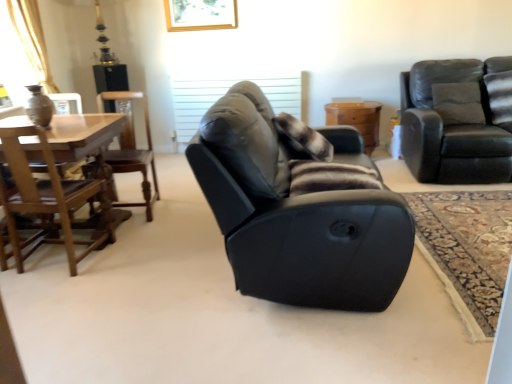
Question: Is velvet dark gray couch at upper right, which is counted as the 4th chair, starting from the left, wider or thinner than wooden chair at left, marked as the 3th chair in a right-to-left arrangement?

Choices:
 (A) wide
 (B) thin

Answer: (A)

Question: From a real-world perspective, relative to wooden chair at left, placed as the second chair when sorted from left to right, is velvet dark gray couch at upper right, which is counted as the 4th chair, starting from the left, vertically above or below?

Choices:
 (A) above
 (B) below

Answer: (A)

Question: Which object is positioned farthest from the velvet dark gray couch at upper right, which appears as the 1th chair when viewed from the right?

Choices:
 (A) wooden chair at left, placed as the second chair when sorted from left to right
 (B) wooden chest at center
 (C) wooden chair at left, marked as the 1th chair in a left-to-right arrangement
 (D) black leather recliner at center, the 3th chair in the left-to-right sequence
 (E) brown fuzzy pillow at center

Answer: (C)

Question: Which of these objects is positioned farthest from the brown fuzzy pillow at center?

Choices:
 (A) black leather recliner at center, which appears as the 2th chair when viewed from the right
 (B) wooden chair at left, placed as the second chair when sorted from left to right
 (C) velvet dark gray couch at upper right, which appears as the 1th chair when viewed from the right
 (D) wooden chest at center
 (E) wooden chair at left, marked as the 1th chair in a left-to-right arrangement

Answer: (C)